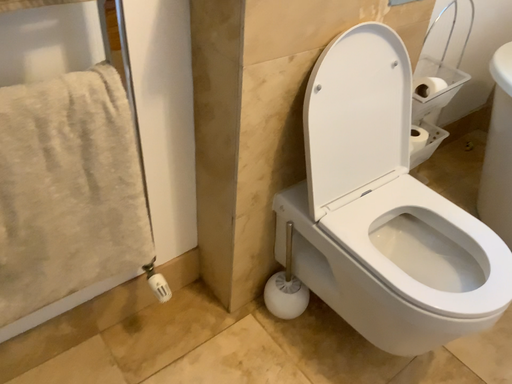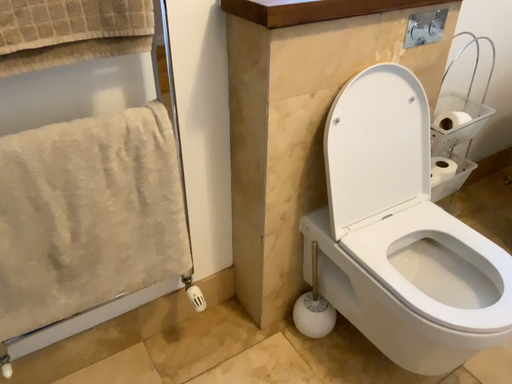
Question: Which way did the camera rotate in the video?

Choices:
 (A) rotated left
 (B) rotated right

Answer: (A)